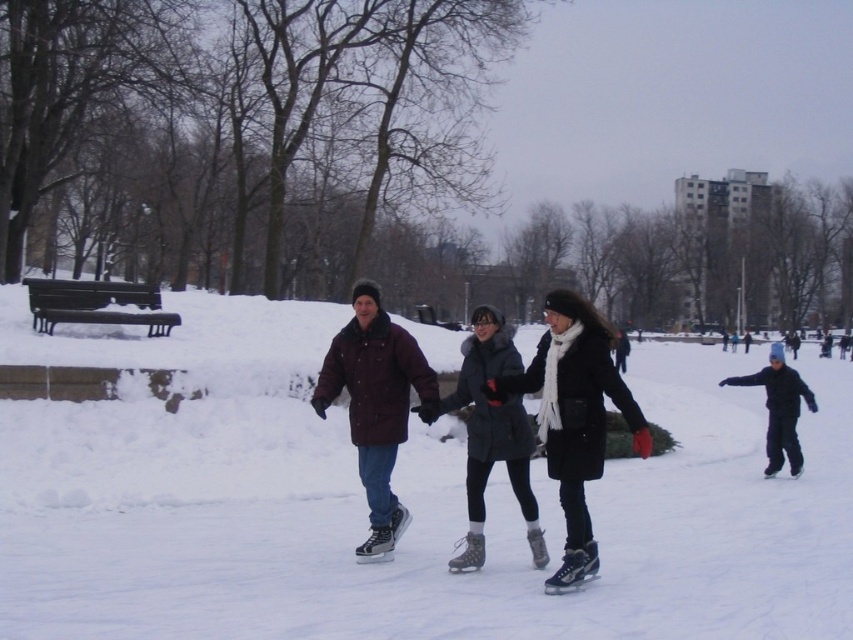
Question: Observing the image, what is the correct spatial positioning of black matte coat at center in reference to maroon woolen jacket at center?

Choices:
 (A) left
 (B) right

Answer: (B)

Question: Considering the real-world distances, which object is farthest from the maroon woolen jacket at center?

Choices:
 (A) black matte coat at center
 (B) black matte jacket at lower right

Answer: (B)

Question: Is black matte coat at center above black matte jacket at lower right?

Choices:
 (A) yes
 (B) no

Answer: (A)

Question: Which object appears farthest from the camera in this image?

Choices:
 (A) black matte coat at center
 (B) maroon woolen jacket at center

Answer: (B)

Question: Is maroon woolen jacket at center above black matte jacket at lower right?

Choices:
 (A) yes
 (B) no

Answer: (A)

Question: Which object is positioned closest to the black matte jacket at lower right?

Choices:
 (A) black matte coat at center
 (B) maroon woolen jacket at center

Answer: (A)